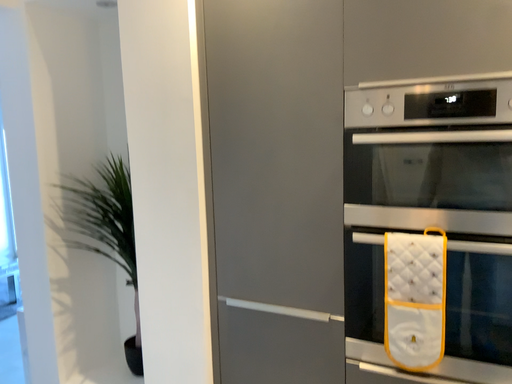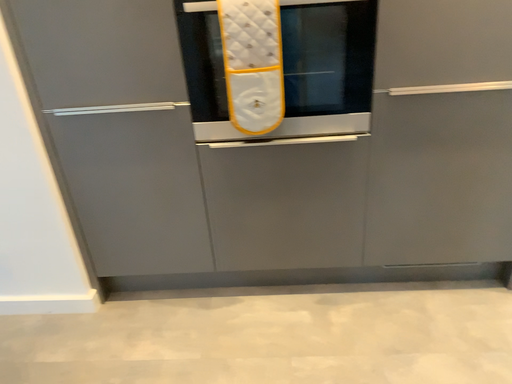
Question: How did the camera likely rotate when shooting the video?

Choices:
 (A) rotated right
 (B) rotated left

Answer: (A)